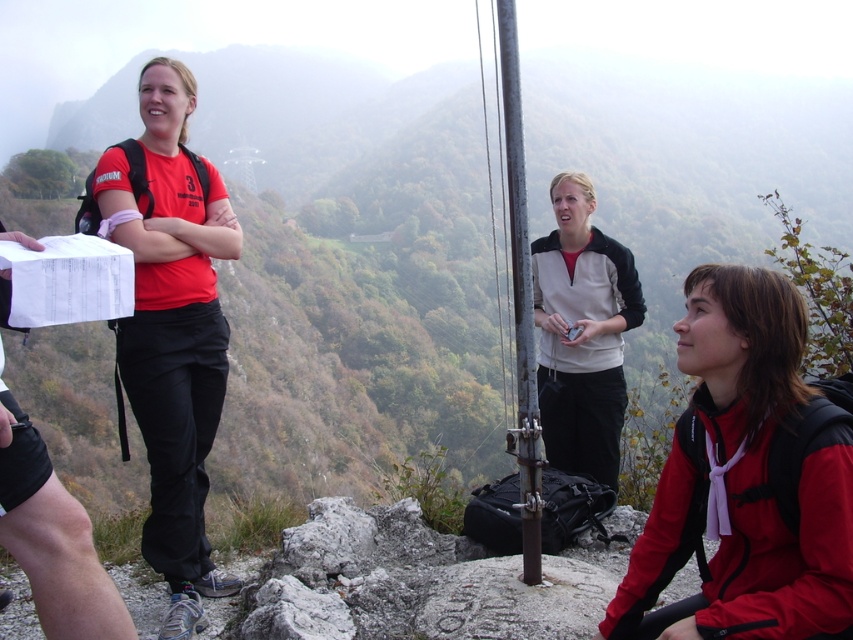
Is matte red jacket at lower right wider than white fleece jacket at center?

In fact, matte red jacket at lower right might be narrower than white fleece jacket at center.

Who is higher up, matte red jacket at lower right or white fleece jacket at center?

Positioned higher is white fleece jacket at center.

The image size is (853, 640). What do you see at coordinates (747, 477) in the screenshot? I see `matte red jacket at lower right` at bounding box center [747, 477].

Locate an element on the screen. matte red jacket at lower right is located at coordinates (747, 477).

In the scene shown: Can you confirm if matte red jacket at lower right is wider than metallic pole at center?

Yes, matte red jacket at lower right is wider than metallic pole at center.

The image size is (853, 640). What do you see at coordinates (747, 477) in the screenshot? I see `matte red jacket at lower right` at bounding box center [747, 477].

Measure the distance between matte red jacket at lower right and camera.

The distance of matte red jacket at lower right from camera is 2.00 meters.

Identify the location of matte red jacket at lower right. The width and height of the screenshot is (853, 640). (747, 477).

Does white fleece jacket at center have a greater width compared to metallic pole at center?

Correct, the width of white fleece jacket at center exceeds that of metallic pole at center.

Does point (598, 460) come behind point (521, 477)?

Yes.

Does point (567, 397) come closer to viewer compared to point (523, 563)?

No, it is not.

This screenshot has width=853, height=640. In order to click on white fleece jacket at center in this screenshot , I will do `click(582, 332)`.